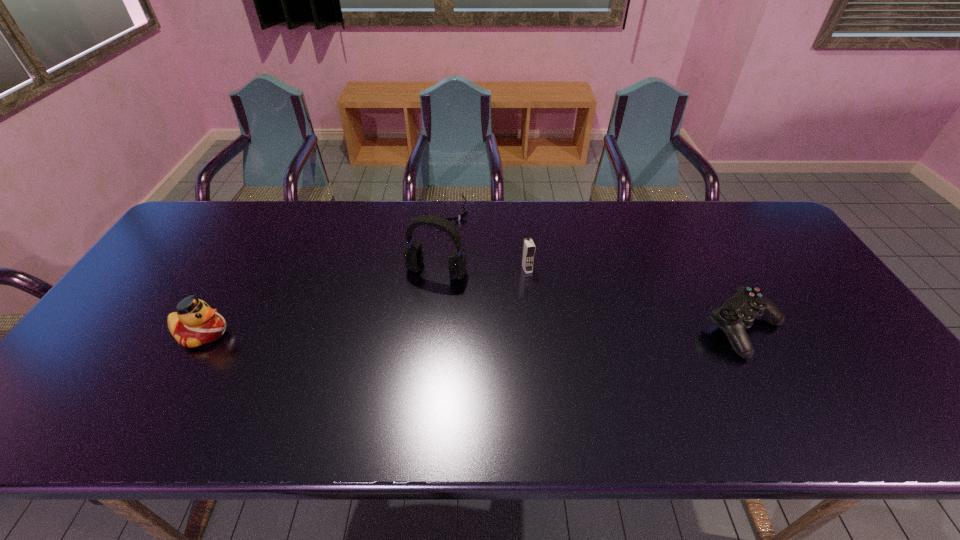
In the image, there is a desktop. In order to click on free space at the far edge in this screenshot , I will do 540,200.

I want to click on free space at the near edge of the desktop, so click(796, 383).

This screenshot has width=960, height=540. Identify the location of vacant space at the left edge of the desktop. (151, 269).

The height and width of the screenshot is (540, 960). In the image, there is a desktop. Identify the location of free space at the far left corner. (231, 229).

I want to click on vacant space at the far right corner of the desktop, so click(757, 210).

Locate an element on the screen. vacant region between the headset and the fourth object from left to right is located at coordinates (482, 270).

Find the location of a particular element. The width and height of the screenshot is (960, 540). vacant space that's between the headset and the cellular telephone is located at coordinates (482, 270).

Where is `unoccupied position between the farthest object and the second shortest object`? The width and height of the screenshot is (960, 540). unoccupied position between the farthest object and the second shortest object is located at coordinates (593, 271).

This screenshot has height=540, width=960. In order to click on vacant region between the shortest object and the second shortest object in this screenshot , I will do `click(593, 271)`.

Locate an element on the screen. The width and height of the screenshot is (960, 540). blank region between the headset and the third tallest object is located at coordinates (320, 302).